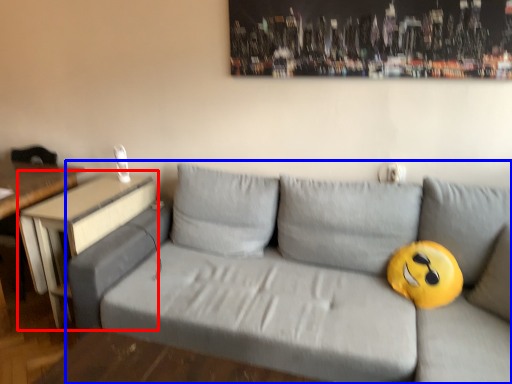
Question: Which point is further to the camera, table (highlighted by a red box) or studio couch (highlighted by a blue box)?

Choices:
 (A) table
 (B) studio couch

Answer: (A)